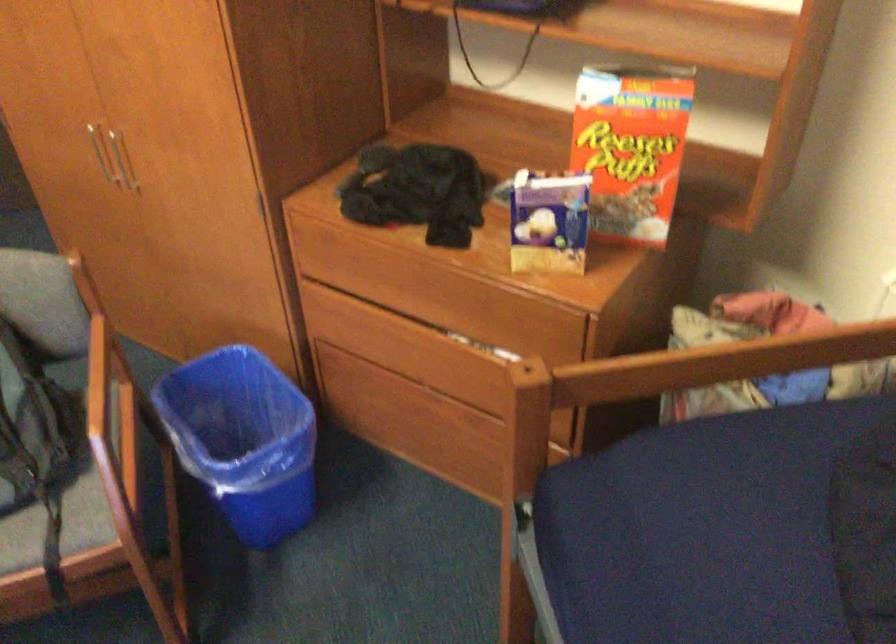
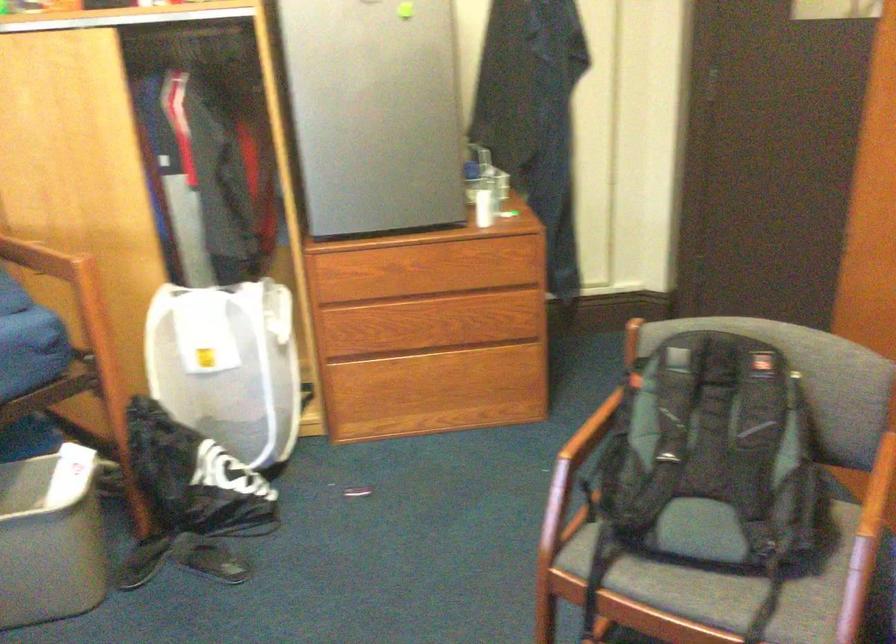
Where in the second image is the point corresponding to (101,418) from the first image?

(871, 520)